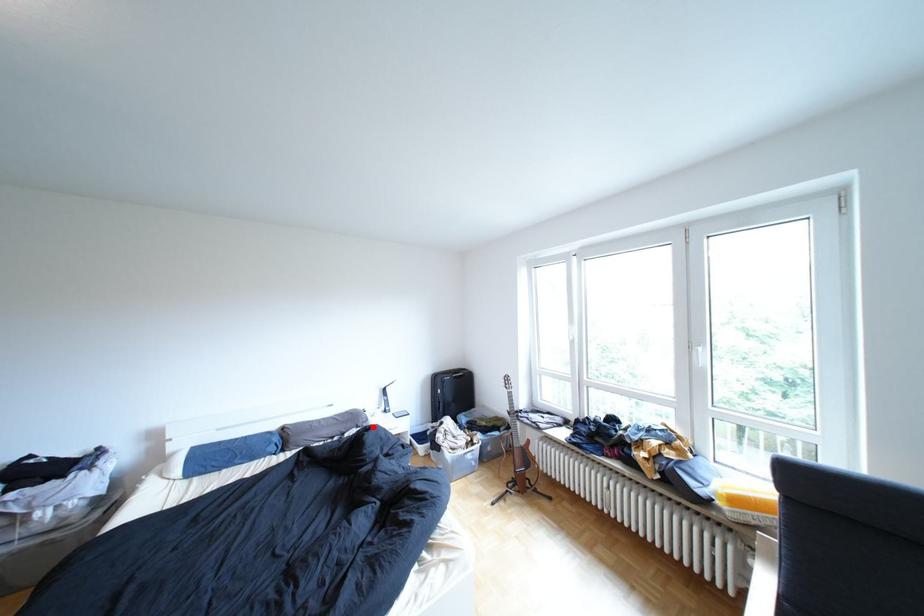
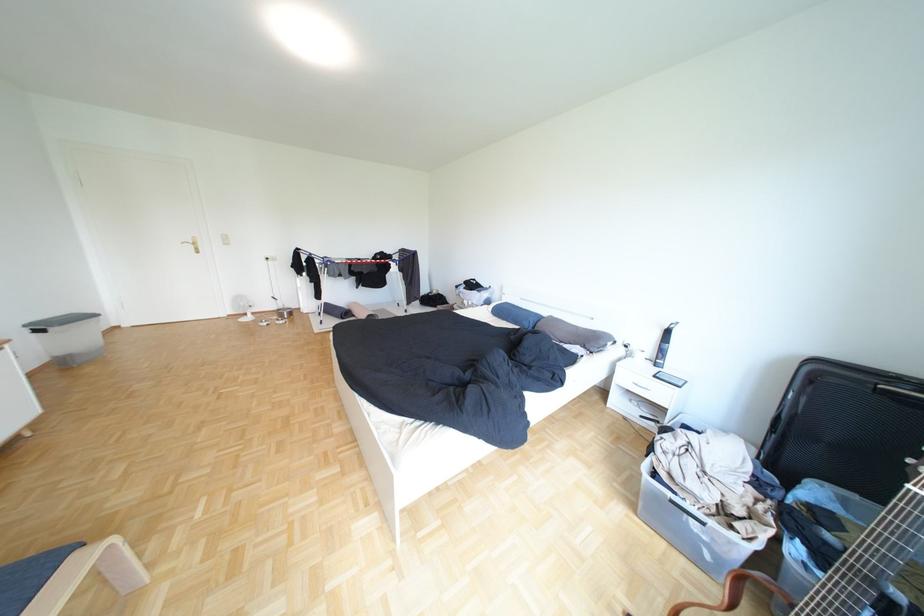
Where in the second image is the point corresponding to the highlighted location from the first image?

(600, 347)